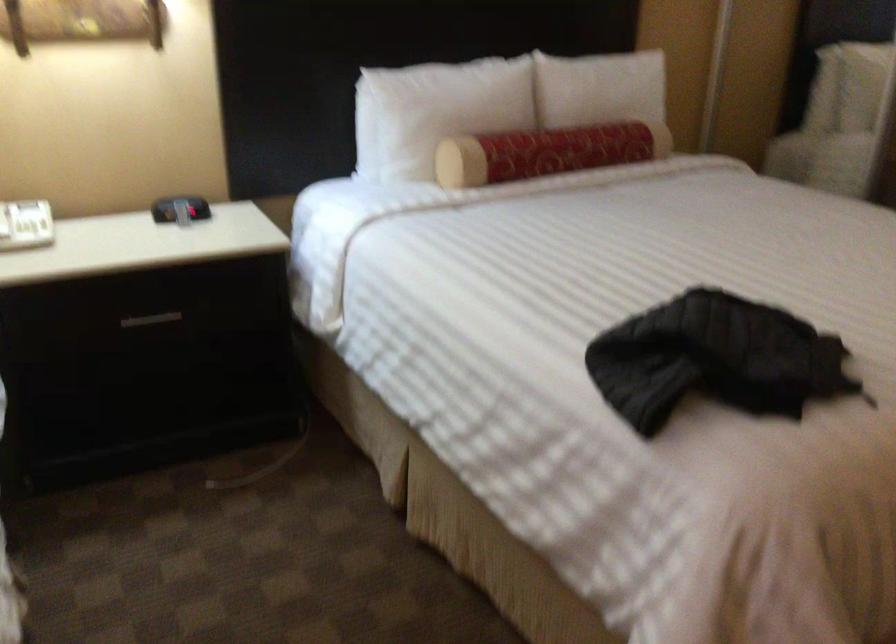
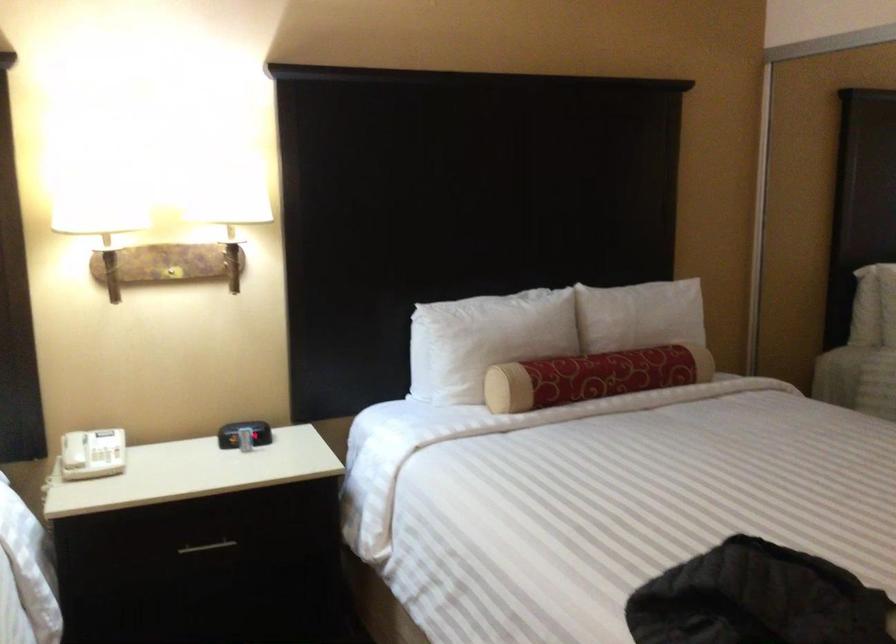
Question: What movement of the cameraman would produce the second image?

Choices:
 (A) Left
 (B) Right
 (C) Forward
 (D) Backward

Answer: (D)